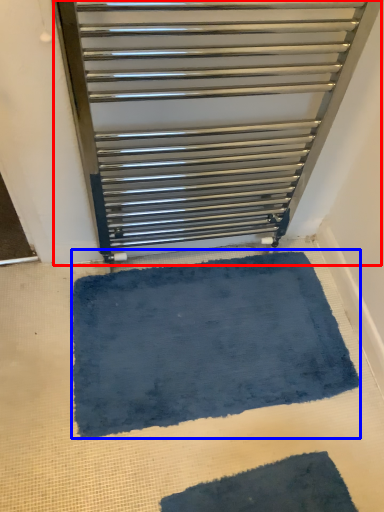
Question: Which object appears farthest to the camera in this image, furniture (highlighted by a red box) or bath mat (highlighted by a blue box)?

Choices:
 (A) furniture
 (B) bath mat

Answer: (B)